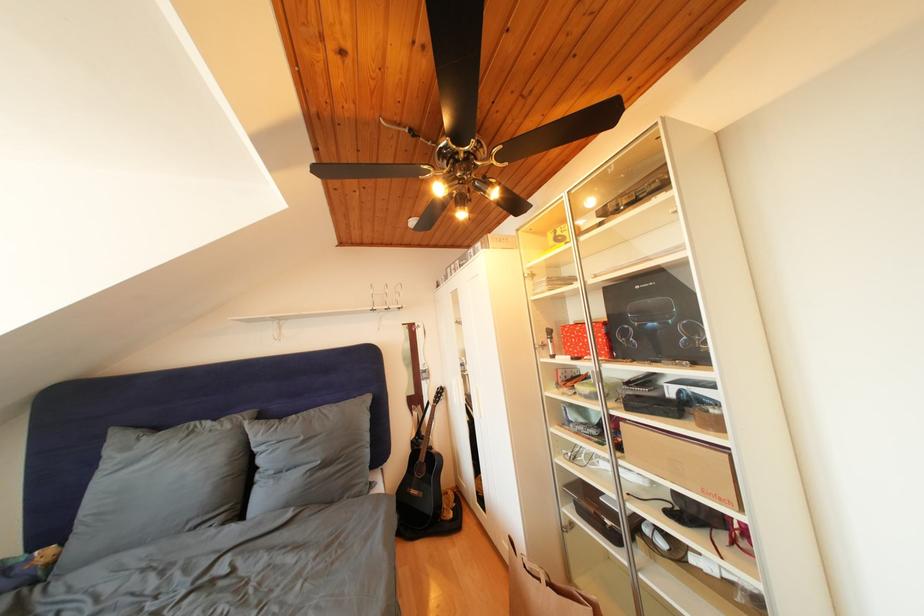
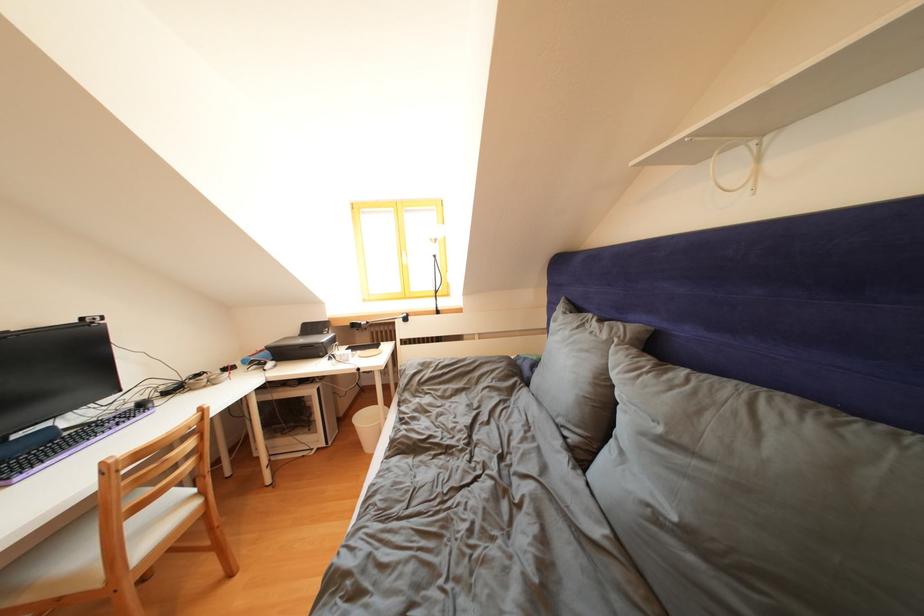
The point at (310, 444) is marked in the first image. Where is the corresponding point in the second image?

(667, 435)